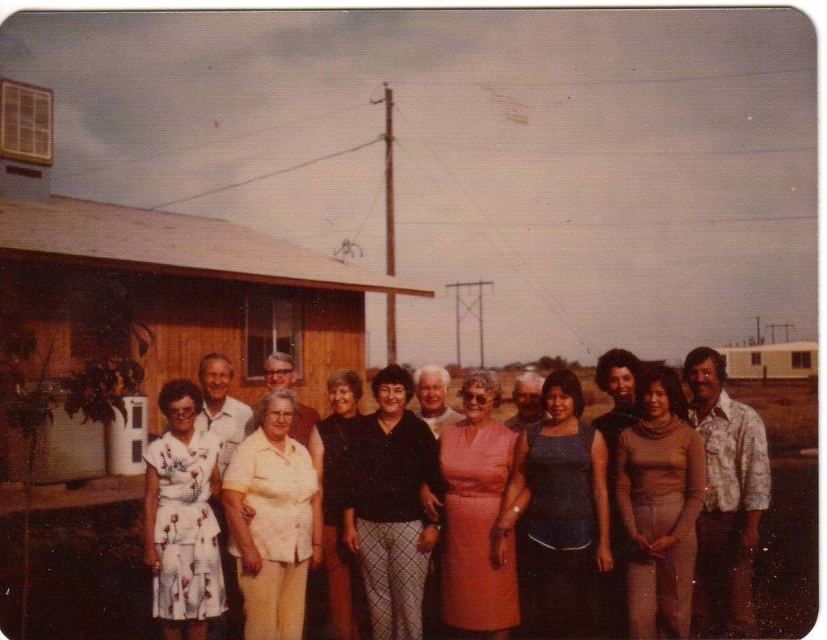
Question: Which point is closer to the camera?

Choices:
 (A) pink satin dress at center
 (B) black matte pants at center
 (C) wooden hut at center
 (D) blue fabric dress at center

Answer: (A)

Question: Which of the following is the closest to the observer?

Choices:
 (A) (644, 438)
 (B) (163, 385)
 (C) (639, 545)

Answer: (C)

Question: Is white cotton blouse at center positioned behind black matte dress at center?

Choices:
 (A) no
 (B) yes

Answer: (A)

Question: Which object appears closest to the camera in this image?

Choices:
 (A) white cotton blouse at center
 (B) wooden hut at center
 (C) floral cotton dress at center

Answer: (A)

Question: Can you confirm if blue fabric dress at center is positioned to the left of white cotton blouse at center?

Choices:
 (A) no
 (B) yes

Answer: (A)

Question: Does wooden hut at center lie in front of beige jersey dress at center?

Choices:
 (A) yes
 (B) no

Answer: (B)